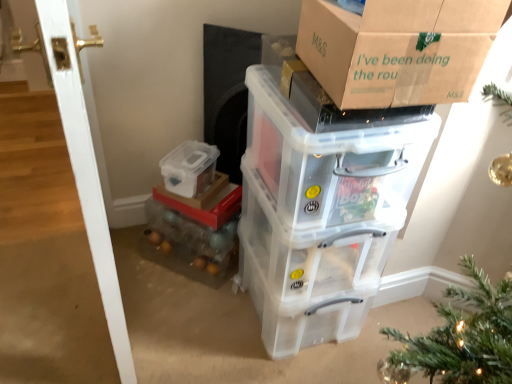
Question: Does translucent plastic storage box at lower center, the third storage box viewed from the top, appear on the right side of transparent plastic storage box at upper right, marked as the fourth storage box in a bottom-to-top arrangement?

Choices:
 (A) yes
 (B) no

Answer: (B)

Question: Would you say translucent plastic storage box at lower center, the third storage box viewed from the top, is a long distance from transparent plastic storage box at upper right, acting as the first storage box starting from the top?

Choices:
 (A) yes
 (B) no

Answer: (B)

Question: From a real-world perspective, is translucent plastic storage box at lower center, the third storage box viewed from the top, on top of transparent plastic storage box at upper right, marked as the fourth storage box in a bottom-to-top arrangement?

Choices:
 (A) yes
 (B) no

Answer: (B)

Question: From the image's perspective, is translucent plastic storage box at lower center, the third storage box viewed from the top, under transparent plastic storage box at upper right, marked as the fourth storage box in a bottom-to-top arrangement?

Choices:
 (A) yes
 (B) no

Answer: (A)

Question: Is translucent plastic storage box at lower center, the third storage box viewed from the top, not inside transparent plastic storage box at upper right, acting as the first storage box starting from the top?

Choices:
 (A) no
 (B) yes

Answer: (B)

Question: From the image's perspective, relative to transparent plastic storage box at lower center, which ranks as the 3th storage box in bottom-to-top order, is transparent plastic storage box at center, which is counted as the first storage box, starting from the bottom, above or below?

Choices:
 (A) above
 (B) below

Answer: (B)

Question: Based on their sizes in the image, would you say transparent plastic storage box at center, which is counted as the first storage box, starting from the bottom, is bigger or smaller than transparent plastic storage box at lower center, which ranks as the 3th storage box in bottom-to-top order?

Choices:
 (A) small
 (B) big

Answer: (B)

Question: Is transparent plastic storage box at center, which is counted as the first storage box, starting from the bottom, in front of or behind transparent plastic storage box at lower center, which ranks as the 3th storage box in bottom-to-top order, in the image?

Choices:
 (A) front
 (B) behind

Answer: (A)

Question: From a real-world perspective, is transparent plastic storage box at center, which is counted as the first storage box, starting from the bottom, above or below transparent plastic storage box at lower center, marked as the second storage box in a top-to-bottom arrangement?

Choices:
 (A) below
 (B) above

Answer: (A)

Question: Is translucent plastic storage box at lower center, the third storage box viewed from the top, wider or thinner than clear plastic microwave at center?

Choices:
 (A) wide
 (B) thin

Answer: (A)

Question: Is translucent plastic storage box at lower center, the third storage box viewed from the top, in front of or behind clear plastic microwave at center in the image?

Choices:
 (A) front
 (B) behind

Answer: (B)

Question: From their relative heights in the image, would you say translucent plastic storage box at lower center, the third storage box viewed from the top, is taller or shorter than clear plastic microwave at center?

Choices:
 (A) tall
 (B) short

Answer: (B)

Question: Visually, is translucent plastic storage box at lower center, the third storage box viewed from the top, positioned to the left or to the right of clear plastic microwave at center?

Choices:
 (A) right
 (B) left

Answer: (B)

Question: Is point (65, 34) closer or farther from the camera than point (300, 327)?

Choices:
 (A) farther
 (B) closer

Answer: (B)

Question: From the image's perspective, is white glossy door at left above or below transparent plastic storage box at center, which is counted as the first storage box, starting from the bottom?

Choices:
 (A) below
 (B) above

Answer: (B)